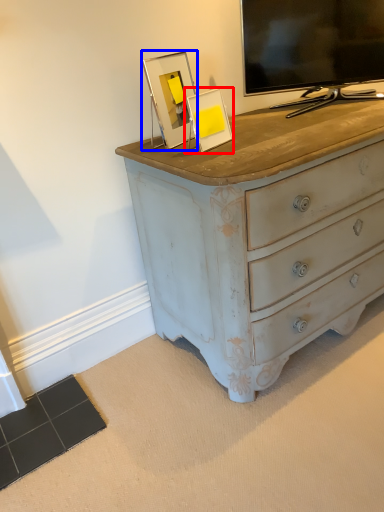
Question: Which object appears closest to the camera in this image, picture frame (highlighted by a red box) or picture frame (highlighted by a blue box)?

Choices:
 (A) picture frame
 (B) picture frame

Answer: (A)